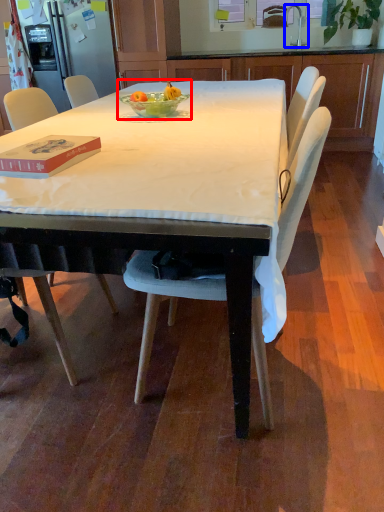
Question: Which object appears farthest to the camera in this image, fruit dish (highlighted by a red box) or faucet (highlighted by a blue box)?

Choices:
 (A) fruit dish
 (B) faucet

Answer: (B)